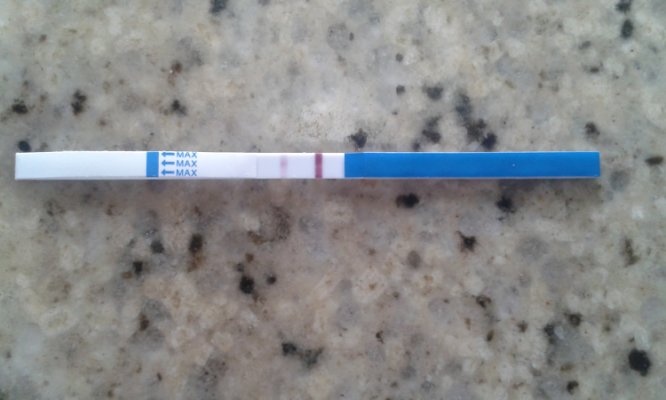
Identify the location of corner. (623, 29).